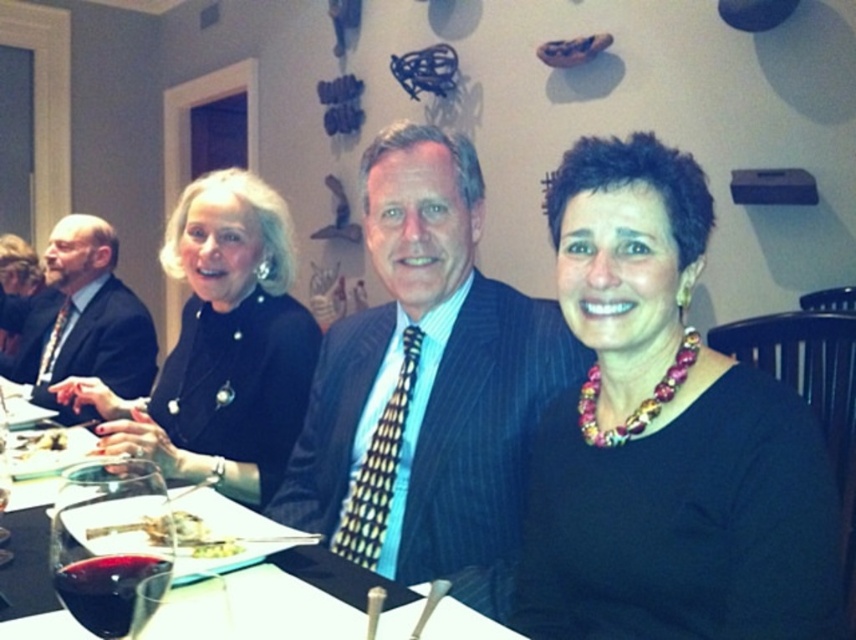
Can you confirm if translucent glass wine at center is bigger than white creamy food at lower left?

Yes.

Measure the distance from translucent glass wine at center to white creamy food at lower left.

translucent glass wine at center and white creamy food at lower left are 52.84 centimeters apart.

The height and width of the screenshot is (640, 856). I want to click on translucent glass wine at center, so click(x=27, y=564).

Looking at this image, who is shorter, multicolored beaded necklace at center or white creamy food at lower left?

white creamy food at lower left is shorter.

I want to click on multicolored beaded necklace at center, so click(x=664, y=436).

I want to click on multicolored beaded necklace at center, so click(x=664, y=436).

Based on the photo, is translucent glass wine at lower left wider than golden brown bread at center?

Yes.

At what (x,y) coordinates should I click in order to perform the action: click on translucent glass wine at lower left. Please return your answer as a coordinate pair (x, y). This screenshot has width=856, height=640. Looking at the image, I should click on (107, 554).